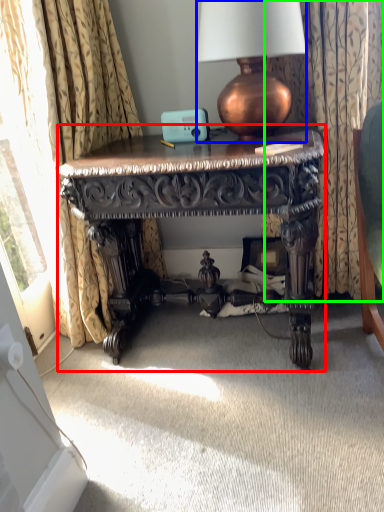
Question: Estimate the real-world distances between objects in this image. Which object is farther from desk (highlighted by a red box), lamp (highlighted by a blue box) or curtain (highlighted by a green box)?

Choices:
 (A) lamp
 (B) curtain

Answer: (B)